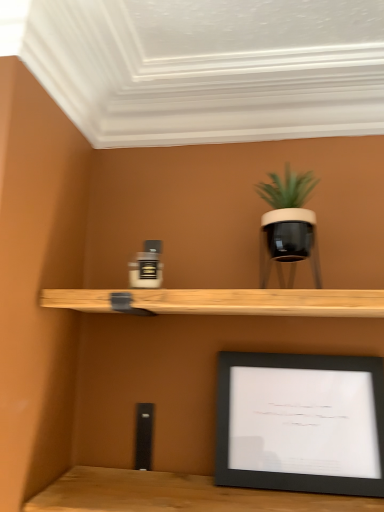
Question: From a real-world perspective, is matte black pot at upper right under black matte picture frame at lower right?

Choices:
 (A) yes
 (B) no

Answer: (B)

Question: From the image's perspective, would you say matte black pot at upper right is shown under black matte picture frame at lower right?

Choices:
 (A) no
 (B) yes

Answer: (A)

Question: Can we say matte black pot at upper right lies outside black matte picture frame at lower right?

Choices:
 (A) yes
 (B) no

Answer: (A)

Question: Does matte black pot at upper right appear on the right side of black matte picture frame at lower right?

Choices:
 (A) no
 (B) yes

Answer: (A)

Question: Is matte black pot at upper right not near black matte picture frame at lower right?

Choices:
 (A) yes
 (B) no

Answer: (B)

Question: Is matte black pot at upper right closer to camera compared to black matte picture frame at lower right?

Choices:
 (A) no
 (B) yes

Answer: (B)

Question: From a real-world perspective, is black matte picture frame at lower right over matte black pot at upper right?

Choices:
 (A) no
 (B) yes

Answer: (A)

Question: Is black matte picture frame at lower right not inside matte black pot at upper right?

Choices:
 (A) yes
 (B) no

Answer: (A)

Question: Is the depth of black matte picture frame at lower right greater than that of matte black pot at upper right?

Choices:
 (A) no
 (B) yes

Answer: (B)

Question: Can you confirm if black matte picture frame at lower right is positioned to the left of matte black pot at upper right?

Choices:
 (A) yes
 (B) no

Answer: (B)

Question: Can you confirm if black matte picture frame at lower right is taller than matte black pot at upper right?

Choices:
 (A) yes
 (B) no

Answer: (A)

Question: Are black matte picture frame at lower right and matte black pot at upper right far apart?

Choices:
 (A) yes
 (B) no

Answer: (B)

Question: Is point (220, 453) closer or farther from the camera than point (273, 205)?

Choices:
 (A) farther
 (B) closer

Answer: (B)